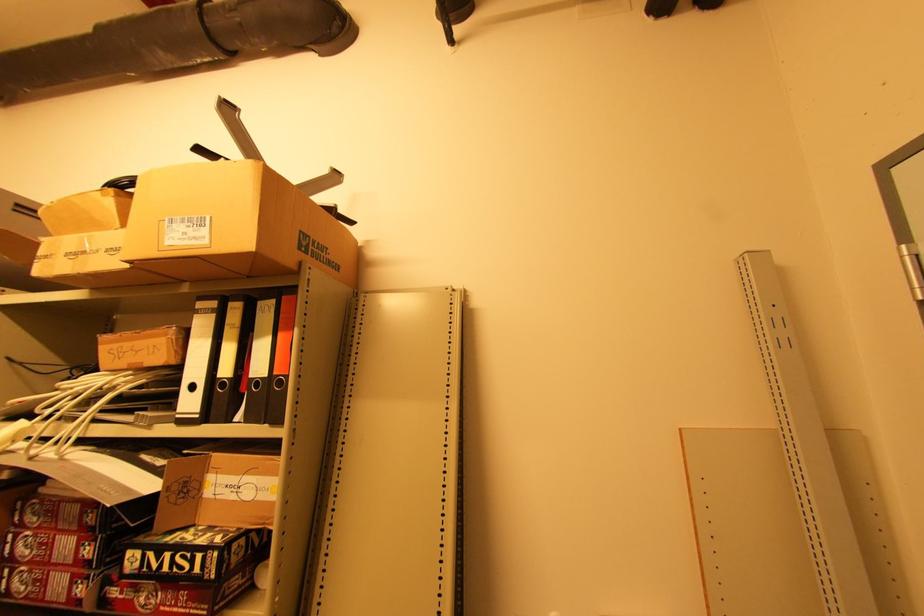
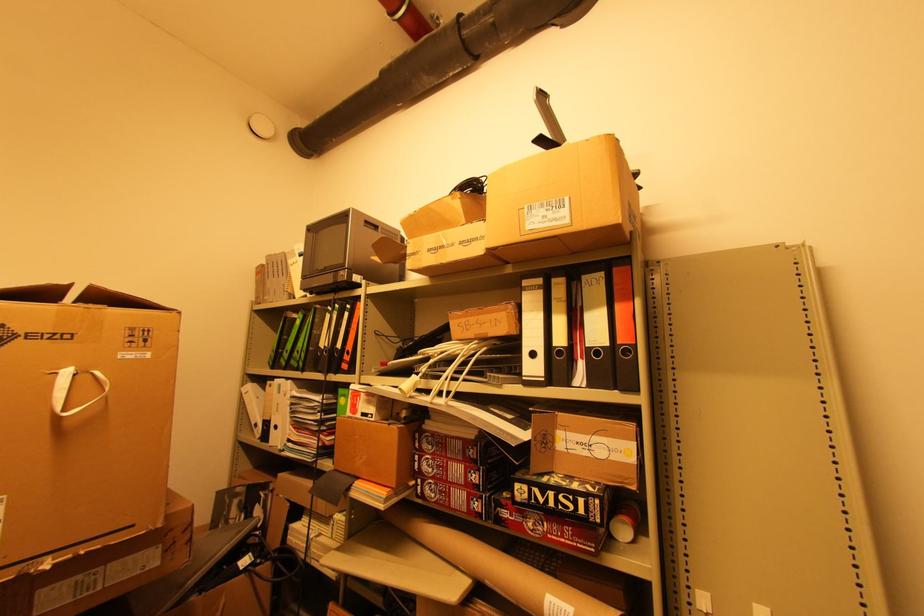
Locate, in the second image, the point that corresponds to point (250, 586) in the first image.

(611, 535)